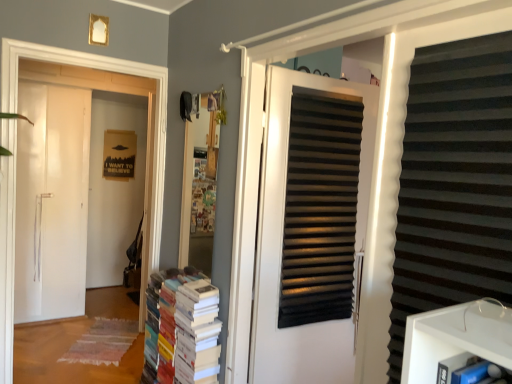
Describe the element at coordinates (454, 183) in the screenshot. The width and height of the screenshot is (512, 384). I see `black matte shutter at right` at that location.

What do you see at coordinates (112, 91) in the screenshot? I see `white matte door at left, placed as the second door when sorted from right to left` at bounding box center [112, 91].

Find the location of a particular element. The image size is (512, 384). white paper book at center is located at coordinates (185, 327).

The image size is (512, 384). I want to click on black matte door at center, the first door when ordered from front to back, so click(282, 242).

Is black matte shutter at right to the left of white matte door at left, which is the 2th door in front-to-back order, from the viewer's perspective?

In fact, black matte shutter at right is to the right of white matte door at left, which is the 2th door in front-to-back order.

Is black matte shutter at right wider or thinner than white matte door at left, placed as the second door when sorted from right to left?

In the image, black matte shutter at right appears to be more narrow than white matte door at left, placed as the second door when sorted from right to left.

How many degrees apart are the facing directions of black matte shutter at right and white matte door at left, positioned as the first door in left-to-right order?

The angle between the facing direction of black matte shutter at right and the facing direction of white matte door at left, positioned as the first door in left-to-right order, is 85.6 degrees.

Between point (428, 223) and point (113, 179), which one is positioned behind?

The point (113, 179) is behind.

From a real-world perspective, who is located higher, white matte door at left, placed as the second door when sorted from right to left, or white paper book at center?

white matte door at left, placed as the second door when sorted from right to left, from a real-world perspective.

Considering the sizes of white matte door at left, which is the 2th door in front-to-back order, and white paper book at center in the image, is white matte door at left, which is the 2th door in front-to-back order, bigger or smaller than white paper book at center?

white matte door at left, which is the 2th door in front-to-back order, is bigger than white paper book at center.

Choose the correct answer: Is white matte door at left, which is the 2th door in front-to-back order, inside white paper book at center or outside it?

white matte door at left, which is the 2th door in front-to-back order, exists outside the volume of white paper book at center.

From the image's perspective, which is below, white matte door at left, positioned as the first door in left-to-right order, or white paper book at center?

white paper book at center is shown below in the image.

From a real-world perspective, is white paper book at center on black matte shutter at right?

No, from a real-world perspective, white paper book at center is not above black matte shutter at right.

From the picture: Considering the sizes of white paper book at center and black matte shutter at right in the image, is white paper book at center wider or thinner than black matte shutter at right?

white paper book at center is wider than black matte shutter at right.

From a real-world perspective, relative to white matte door at left, which ranks as the 1th door in back-to-front order, is white paper book at center vertically above or below?

white paper book at center is below white matte door at left, which ranks as the 1th door in back-to-front order.

Is white paper book at center turned away from white matte door at left, positioned as the first door in left-to-right order?

white paper book at center does not have its back to white matte door at left, positioned as the first door in left-to-right order.

Is white paper book at center inside the boundaries of white matte door at left, which ranks as the 1th door in back-to-front order, or outside?

The correct answer is: outside.

Can you see white paper book at center touching white matte door at left, positioned as the first door in left-to-right order?

There is a gap between white paper book at center and white matte door at left, positioned as the first door in left-to-right order.

Which object is positioned more to the right, black matte shutter at right or white paper book at center?

From the viewer's perspective, black matte shutter at right appears more on the right side.

Which is nearer, (478, 287) or (166, 367)?

Clearly, point (478, 287) is closer to the camera than point (166, 367).

Considering the sizes of black matte shutter at right and white paper book at center in the image, is black matte shutter at right taller or shorter than white paper book at center?

Clearly, black matte shutter at right is taller compared to white paper book at center.

Considering the relative sizes of black matte shutter at right and white paper book at center in the image provided, is black matte shutter at right thinner than white paper book at center?

Correct, the width of black matte shutter at right is less than that of white paper book at center.

Where is `door that appears above the black matte door at center, which ranks as the second door in left-to-right order (from the image's perspective)`? door that appears above the black matte door at center, which ranks as the second door in left-to-right order (from the image's perspective) is located at coordinates (112, 91).

From the image's perspective, which one is positioned lower, black matte door at center, the first door viewed from the right, or white matte door at left, placed as the second door when sorted from right to left?

black matte door at center, the first door viewed from the right.

From the picture: Is black matte door at center, the first door when ordered from front to back, positioned in front of white matte door at left, positioned as the first door in left-to-right order?

Yes, black matte door at center, the first door when ordered from front to back, is closer to the camera.

Considering the sizes of objects white paper book at center and black matte door at center, the first door viewed from the right, in the image provided, who is smaller, white paper book at center or black matte door at center, the first door viewed from the right,?

With smaller size is black matte door at center, the first door viewed from the right.

Where is `book on the left of the black matte door at center, the first door when ordered from front to back`? Image resolution: width=512 pixels, height=384 pixels. book on the left of the black matte door at center, the first door when ordered from front to back is located at coordinates (185, 327).

Is white paper book at center oriented away from black matte door at center, which ranks as the second door in left-to-right order?

No, black matte door at center, which ranks as the second door in left-to-right order, is not at the back of white paper book at center.

In terms of height, does white paper book at center look taller or shorter compared to black matte door at center, the first door when ordered from front to back?

Clearly, white paper book at center is shorter compared to black matte door at center, the first door when ordered from front to back.

Identify the location of shutter on the right of the white matte door at left, placed as the second door when sorted from right to left. The image size is (512, 384). (454, 183).

The height and width of the screenshot is (384, 512). In order to click on book below the white matte door at left, positioned as the first door in left-to-right order (from a real-world perspective) in this screenshot , I will do coord(185,327).

Estimate the real-world distances between objects in this image. Which object is closer to black matte door at center, the first door viewed from the right, white matte door at left, which is the 2th door in front-to-back order, or white paper book at center?

white paper book at center is closer to black matte door at center, the first door viewed from the right.

Looking at the image, which one is located further to white matte door at left, which is the 2th door in front-to-back order, black matte shutter at right or white paper book at center?

black matte shutter at right is positioned further to the anchor white matte door at left, which is the 2th door in front-to-back order.

Which object lies nearer to the anchor point black matte shutter at right, white matte door at left, positioned as the first door in left-to-right order, or black matte door at center, the first door when ordered from front to back?

black matte door at center, the first door when ordered from front to back, is closer to black matte shutter at right.

Estimate the real-world distances between objects in this image. Which object is closer to white paper book at center, black matte door at center, the first door when ordered from front to back, or black matte shutter at right?

Based on the image, black matte door at center, the first door when ordered from front to back, appears to be nearer to white paper book at center.

Which object lies further to the anchor point white matte door at left, placed as the second door when sorted from right to left, white paper book at center or black matte shutter at right?

black matte shutter at right.

When comparing their distances from white matte door at left, positioned as the first door in left-to-right order, does white paper book at center or black matte door at center, the first door when ordered from front to back, seem closer?

Among the two, white paper book at center is located nearer to white matte door at left, positioned as the first door in left-to-right order.

Considering their positions, is white matte door at left, positioned as the first door in left-to-right order, positioned closer to white paper book at center than black matte shutter at right?

The object closer to white paper book at center is white matte door at left, positioned as the first door in left-to-right order.

Looking at the image, which one is located further to white matte door at left, which ranks as the 1th door in back-to-front order, black matte door at center, the first door when ordered from front to back, or white paper book at center?

black matte door at center, the first door when ordered from front to back.

Locate an element on the screen. The height and width of the screenshot is (384, 512). book located between black matte shutter at right and white matte door at left, which ranks as the 1th door in back-to-front order, in the depth direction is located at coordinates (185, 327).

Identify the location of book between black matte door at center, the first door when ordered from front to back, and white matte door at left, which is the 2th door in front-to-back order, from front to back. The image size is (512, 384). (185, 327).

The width and height of the screenshot is (512, 384). What are the coordinates of `door positioned between black matte shutter at right and white matte door at left, which ranks as the 1th door in back-to-front order, from near to far` in the screenshot? It's located at (282, 242).

I want to click on door located between white paper book at center and black matte shutter at right in the left-right direction, so click(x=282, y=242).